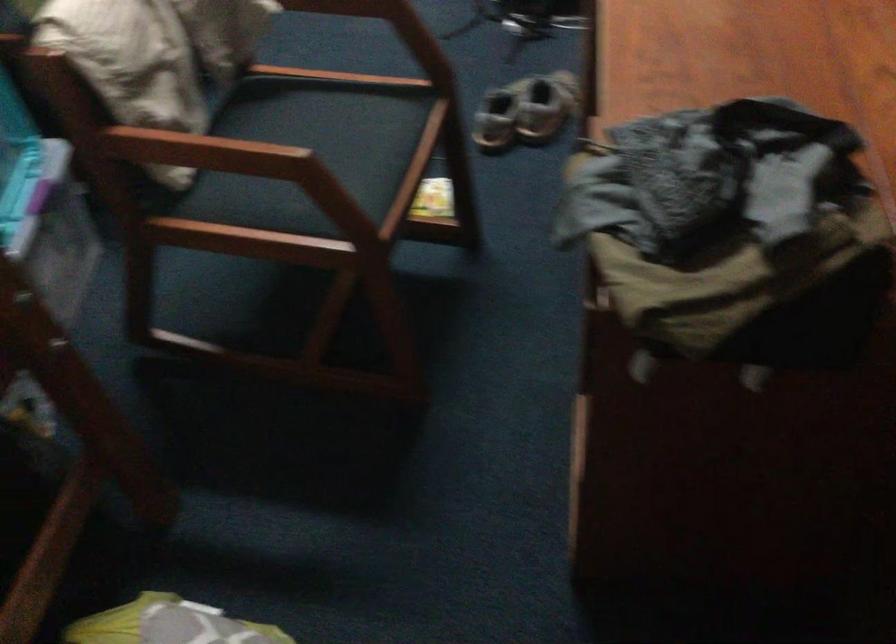
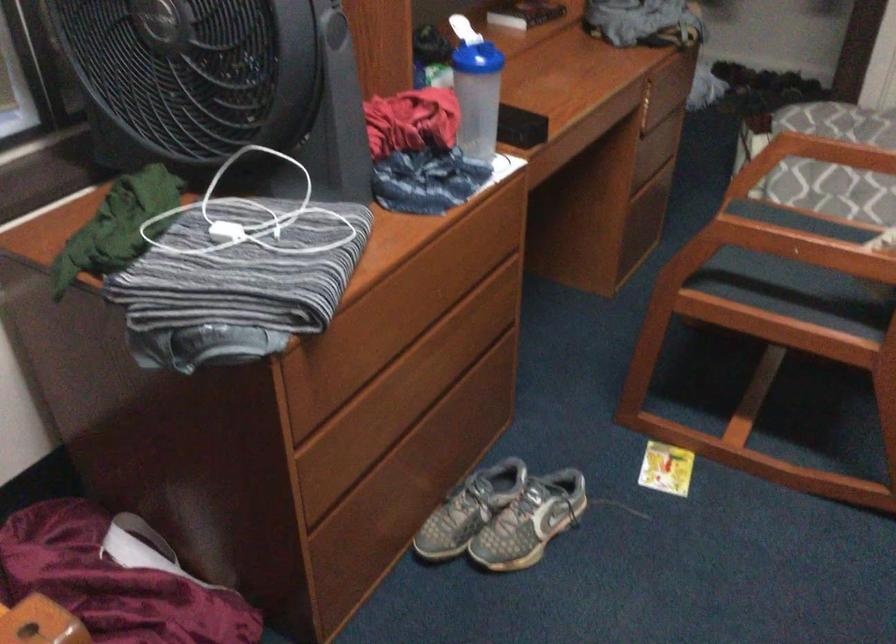
In the second image, find the point that corresponds to (428,196) in the first image.

(666, 468)